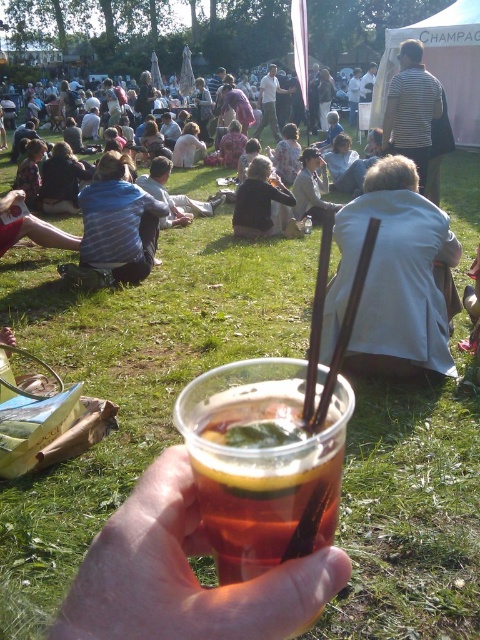
Between point (199, 477) and point (288, 209), which one is positioned behind?

The point (288, 209) is more distant.

Can you confirm if translucent plastic cup at center is thinner than dark gray sweater at center?

Correct, translucent plastic cup at center's width is less than dark gray sweater at center's.

At what (x,y) coordinates should I click in order to perform the action: click on translucent plastic cup at center. Please return your answer as a coordinate pair (x, y). The height and width of the screenshot is (640, 480). Looking at the image, I should click on (264, 490).

Which is in front, point (101, 266) or point (264, 88)?

Point (101, 266) is more forward.

Is point (104, 257) positioned behind point (272, 92)?

No, it is not.

Does point (158, 218) come behind point (269, 116)?

No, it is in front of (269, 116).

Find the location of a particular element. The image size is (480, 640). blue striped shirt at center is located at coordinates coord(119,221).

Describe the element at coordinates (183, 573) in the screenshot. I see `translucent plastic cup at lower center` at that location.

Measure the distance between translucent plastic cup at lower center and camera.

9.91 inches

Where is `translucent plastic cup at lower center`? This screenshot has height=640, width=480. translucent plastic cup at lower center is located at coordinates (183, 573).